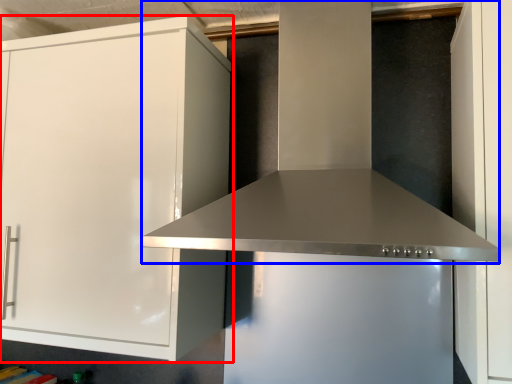
Question: Which object is further to the camera taking this photo, cabinetry (highlighted by a red box) or vent (highlighted by a blue box)?

Choices:
 (A) cabinetry
 (B) vent

Answer: (A)